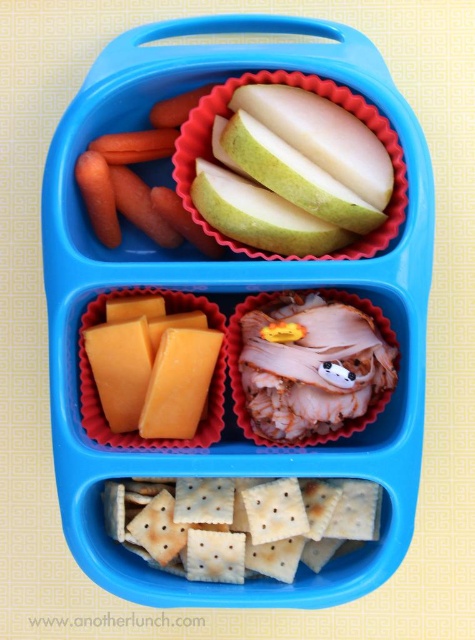
Is orange hard cheese at lower left positioned in front of orange smooth carrot at upper left?

No.

What do you see at coordinates (139, 371) in the screenshot?
I see `orange hard cheese at lower left` at bounding box center [139, 371].

Identify the location of orange hard cheese at lower left. (139, 371).